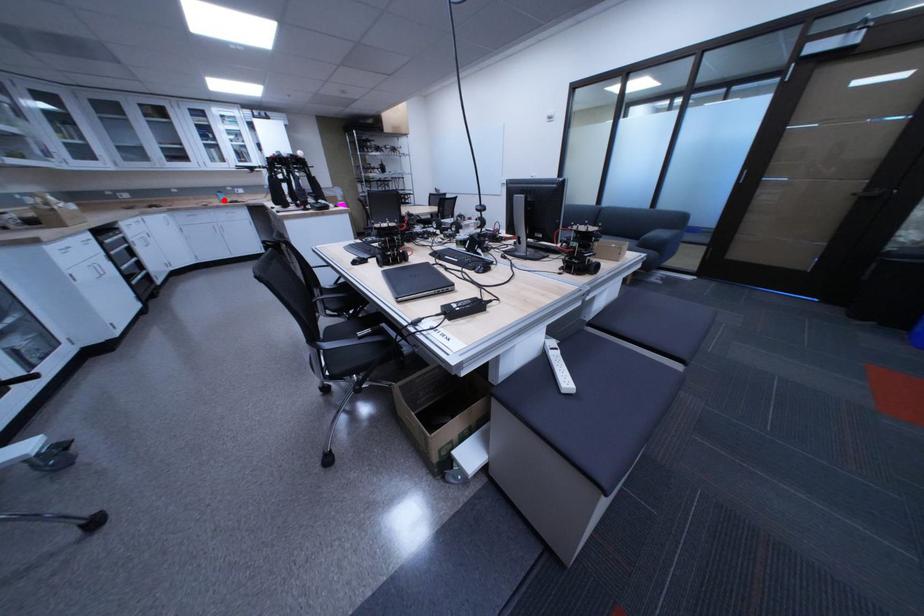
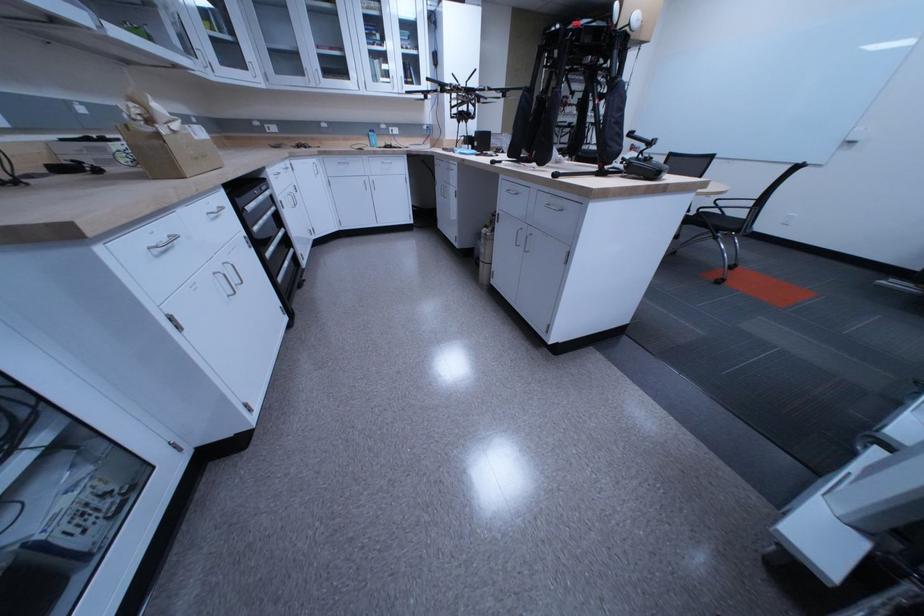
Locate, in the second image, the point that corresponds to the highlighted location in the first image.

(373, 140)